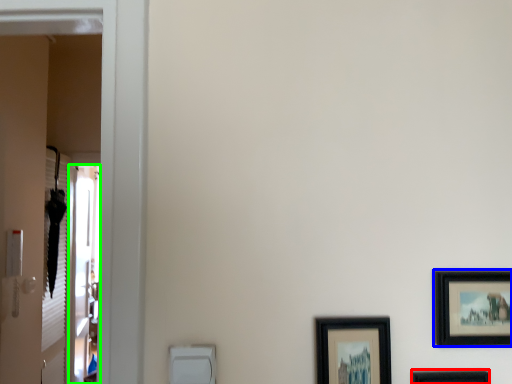
Question: Based on their relative distances, which object is nearer to picture frame (highlighted by a red box)? Choose from picture frame (highlighted by a blue box) and screen door (highlighted by a green box).

Choices:
 (A) picture frame
 (B) screen door

Answer: (A)